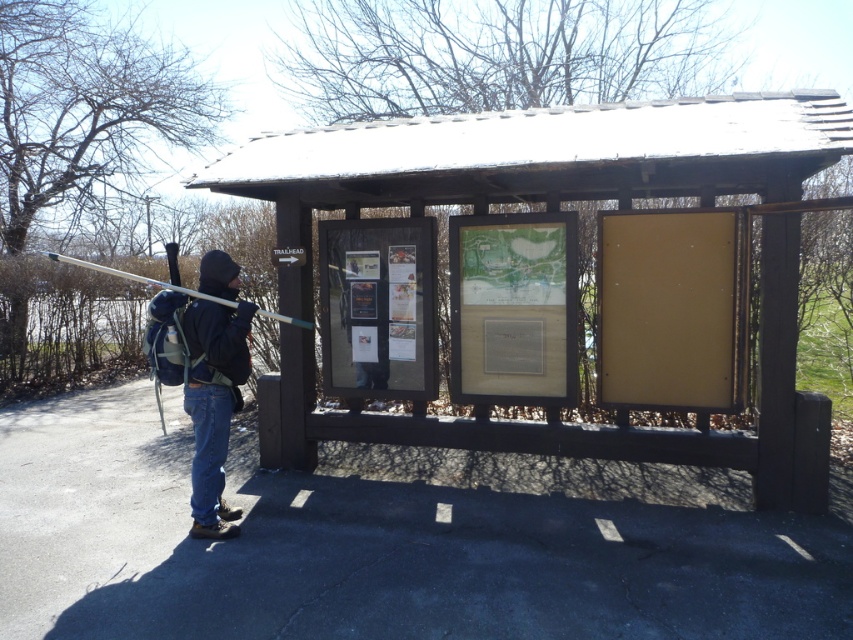
You are a hiker who wants to check the trail map on the wooden structure. You have a black matte jacket at center and a matte white ski pole at left. Which object is closer to you when you are facing the wooden structure?

The black matte jacket at center is closer to you because the matte white ski pole at left is behind it.

You are a hiker trying to read the wooden signboard at center but your matte white ski pole at left is blocking your view. Can you tell me which object is thinner so you can move it out of the way?

The wooden signboard at center is thinner than the matte white ski pole at left, so you should move the matte white ski pole at left to get a better view.

Based on the photo, you are standing at the wooden structure with informational boards. There is a point marked at coordinates (534, 161). Where is this point located?

The point is located on the wooden signboard at center.